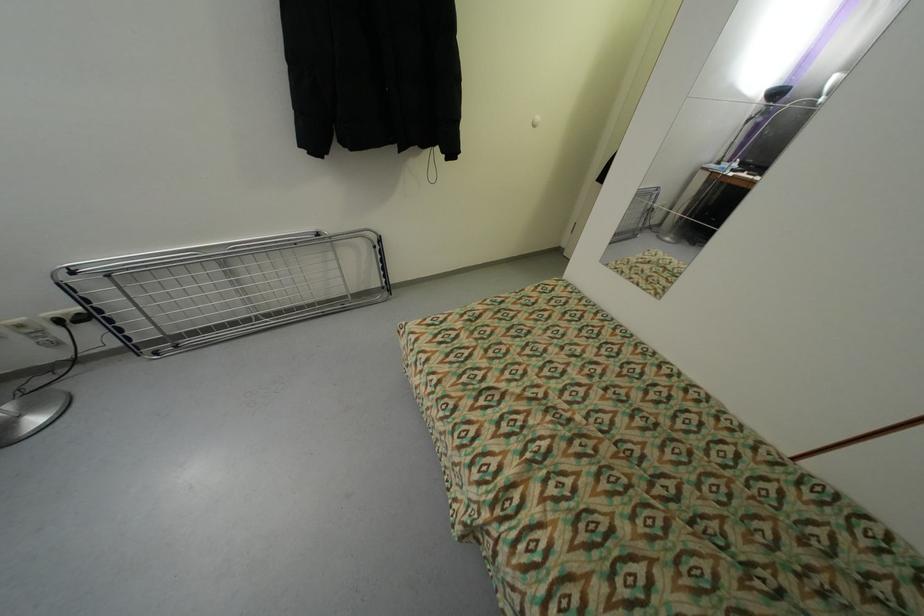
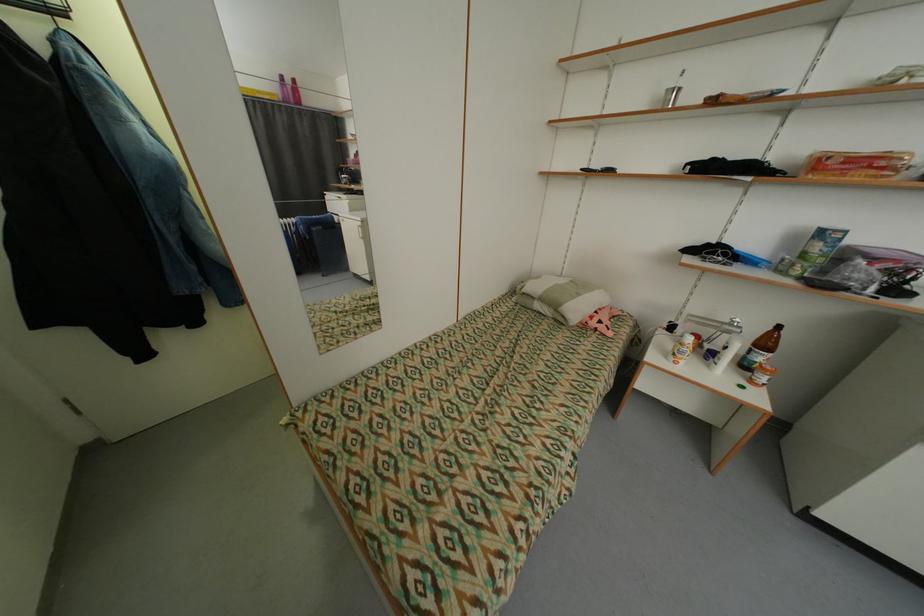
Based on the continuous images, in which direction is the camera rotating?

The camera rotated toward right-down.